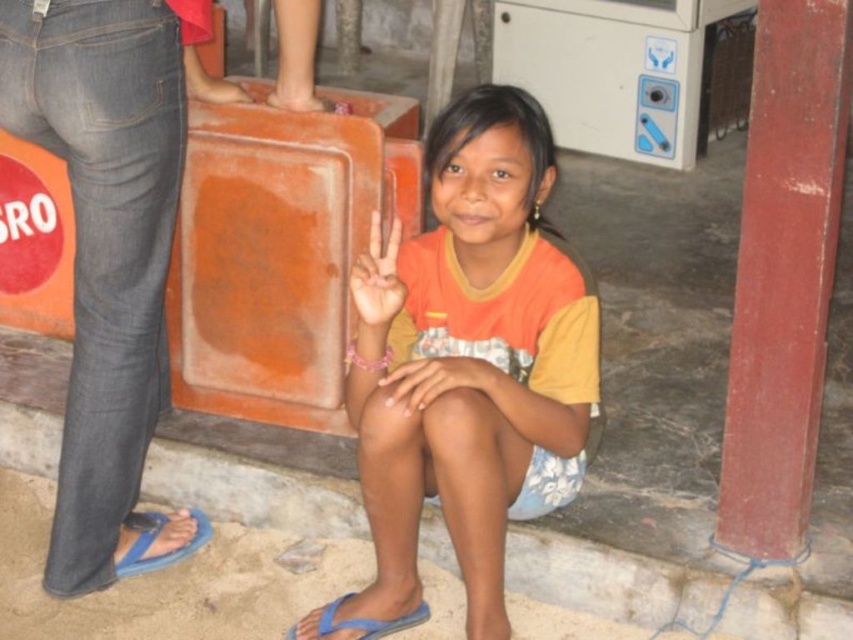
Is orange cotton shirt at center smaller than smooth skin hand at center?

Incorrect, orange cotton shirt at center is not smaller in size than smooth skin hand at center.

Is orange cotton shirt at center to the left of smooth skin hand at center from the viewer's perspective?

In fact, orange cotton shirt at center is to the right of smooth skin hand at center.

Find the location of a particular element. Image resolution: width=853 pixels, height=640 pixels. orange cotton shirt at center is located at coordinates (474, 356).

Which is more to the right, blue rubber sandal at lower left or blue rubber sandal at lower center?

Positioned to the right is blue rubber sandal at lower center.

Is blue rubber sandal at lower left bigger than blue rubber sandal at lower center?

Yes.

This screenshot has height=640, width=853. Describe the element at coordinates (152, 541) in the screenshot. I see `blue rubber sandal at lower left` at that location.

Locate an element on the screen. This screenshot has height=640, width=853. blue rubber sandal at lower left is located at coordinates (152, 541).

Is matte orange shirt at center thinner than blue rubber sandal at lower center?

Correct, matte orange shirt at center's width is less than blue rubber sandal at lower center's.

Based on the photo, does matte orange shirt at center appear under blue rubber sandal at lower center?

No, matte orange shirt at center is not below blue rubber sandal at lower center.

This screenshot has width=853, height=640. Identify the location of matte orange shirt at center. (376, 278).

Identify the location of matte orange shirt at center. The image size is (853, 640). (376, 278).